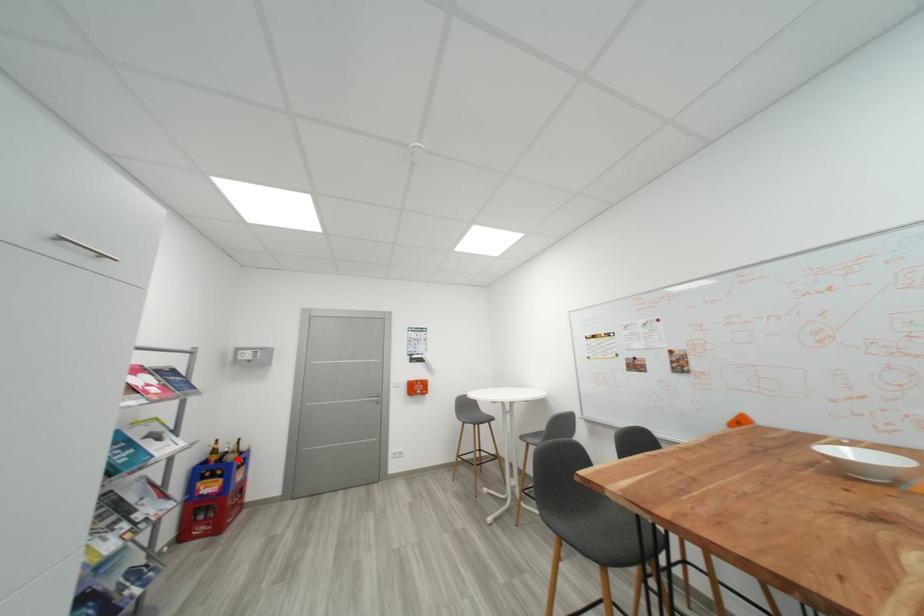
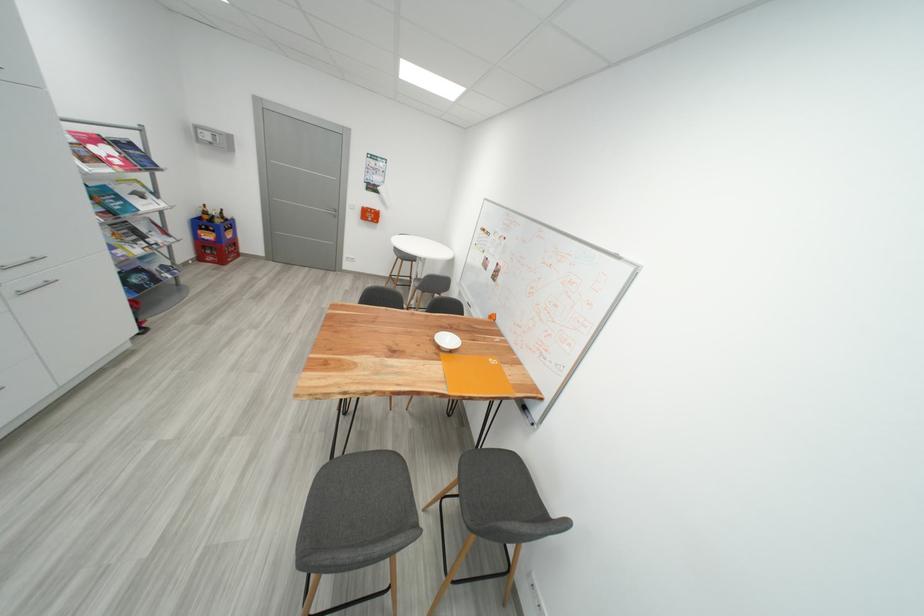
Question: I am providing you with two images of the same scene from different viewpoints. In image1, a red point is highlighted. Considering the same 3D point in image2, which of the following is correct?

Choices:
 (A) It is closer
 (B) It is farther

Answer: (A)